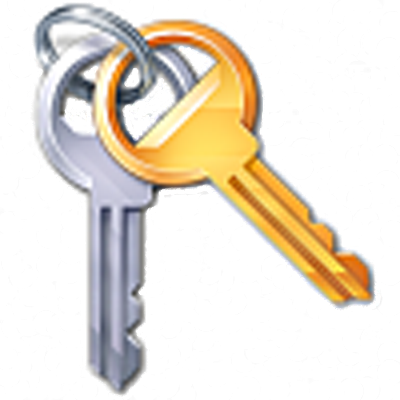
In order to click on space below key ring in this screenshot , I will do `click(127, 105)`.